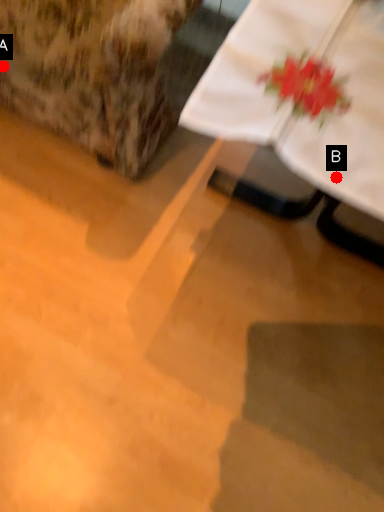
Question: Two points are circled on the image, labeled by A and B beside each circle. Which of the following is the closest to the observer?

Choices:
 (A) A is closer
 (B) B is closer

Answer: (B)